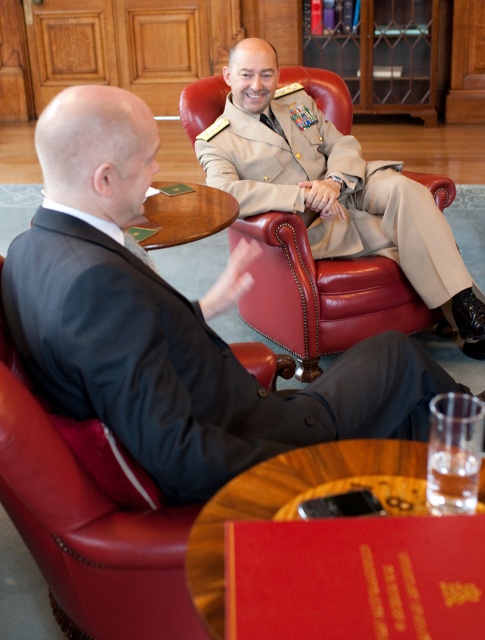
Question: Observing the image, what is the correct spatial positioning of khaki uniform at center in reference to leather armchair at center?

Choices:
 (A) above
 (B) below

Answer: (B)

Question: Based on their relative distances, which object is nearer to the khaki uniform at center?

Choices:
 (A) leather armchair at center
 (B) wooden round table at center

Answer: (B)

Question: Is khaki uniform at center to the left of leather armchair at left from the viewer's perspective?

Choices:
 (A) no
 (B) yes

Answer: (A)

Question: Which of the following is the farthest from the observer?

Choices:
 (A) leather armchair at left
 (B) khaki uniform at center

Answer: (B)

Question: Can you confirm if khaki uniform at center is bigger than wooden round table at center?

Choices:
 (A) yes
 (B) no

Answer: (A)

Question: Which point appears closest to the camera in this image?

Choices:
 (A) (288, 236)
 (B) (31, 474)
 (C) (212, 522)
 (D) (48, 337)

Answer: (C)